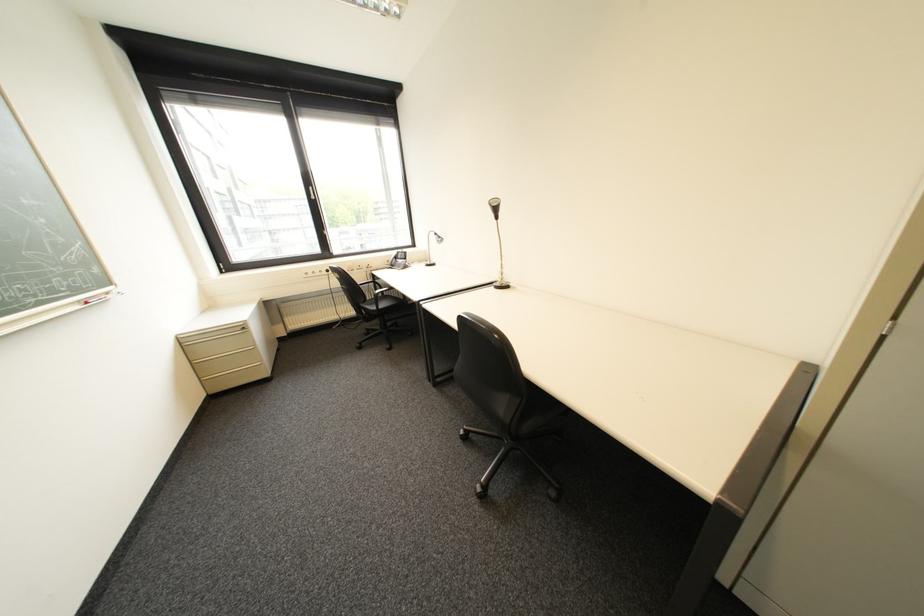
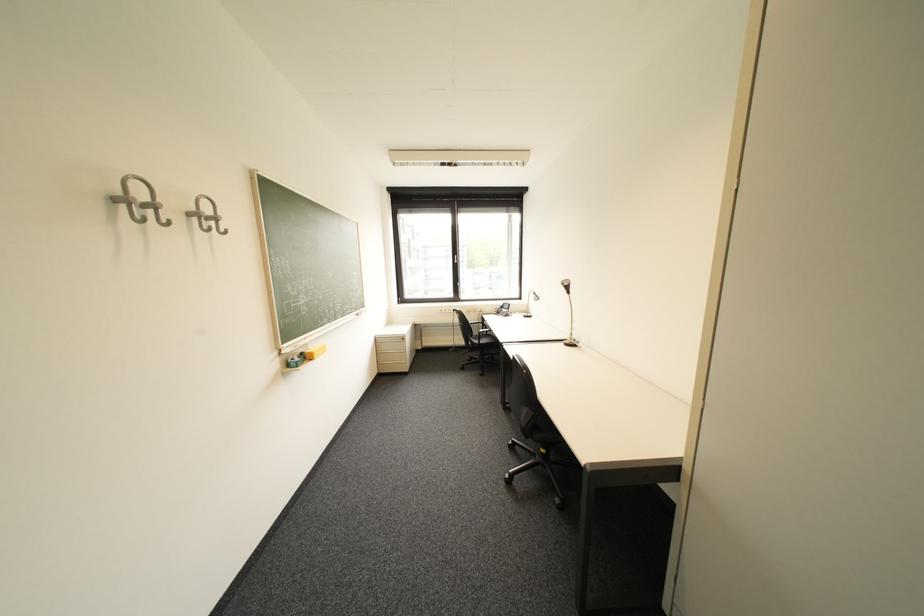
The point at (x=502, y=289) is marked in the first image. Where is the corresponding point in the second image?

(572, 345)